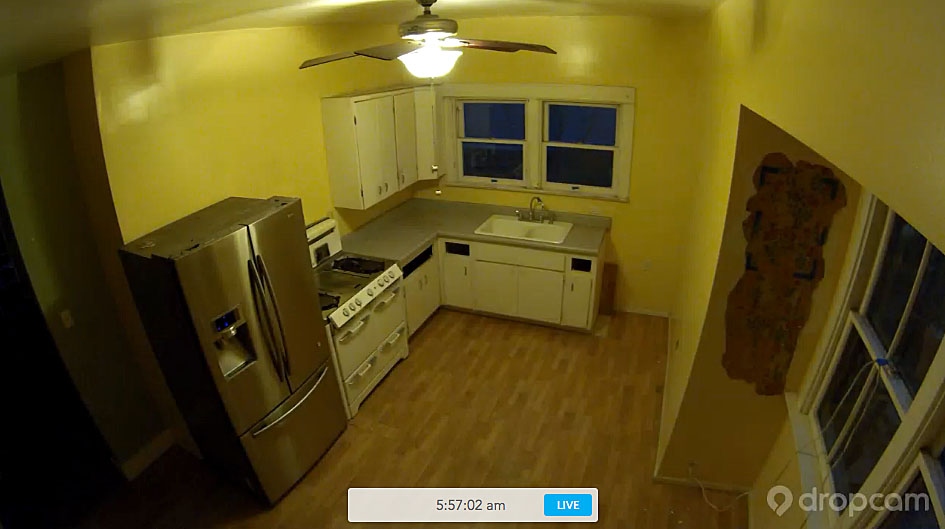
Locate an element on the screen. countertops is located at coordinates (408, 227), (443, 218), (580, 237).